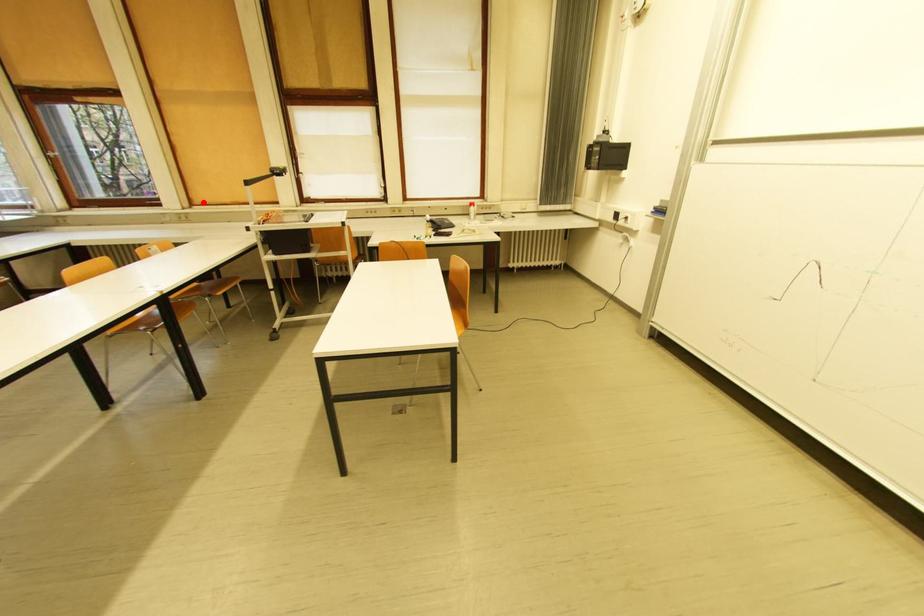
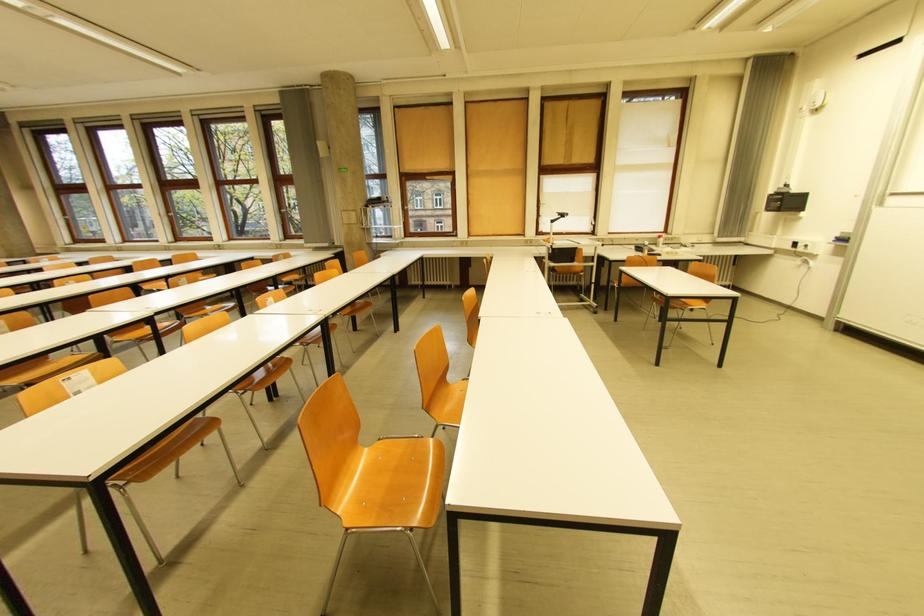
Question: I am providing you with two images of the same scene from different viewpoints. Given a red point in image1, look at the same physical point in image2. Is it:

Choices:
 (A) Closer to the viewpoint
 (B) Farther from the viewpoint

Answer: (A)